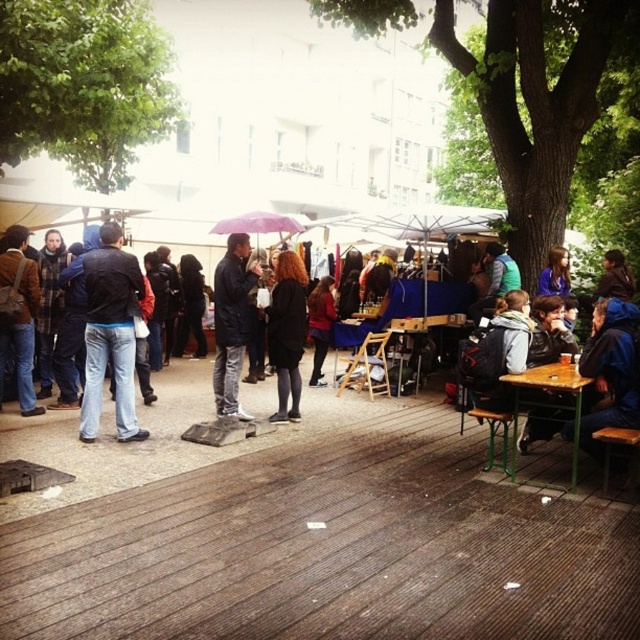
You are a customer at the outdoor market and want to stay dry in case it starts raining. You see the black leather jacket at center and the purple fabric umbrella at center. Which item is positioned above the other?

The purple fabric umbrella at center is positioned above the black leather jacket at center.

You are standing at the center of the wooden deck in the outdoor market scene. There are two points marked on the deck. One is at coordinates point (285,272) and the other is at point (547,292). If you want to walk towards the point that is closer to you, which point should you head towards?

Point (285,272) is in front of point (547,292), so you should head towards point (285,272) since it is closer to your current position on the wooden deck.